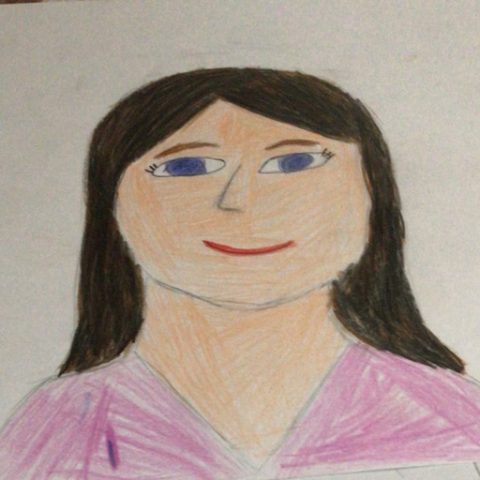
The height and width of the screenshot is (480, 480). In order to click on white wall in this screenshot , I will do `click(184, 39)`.